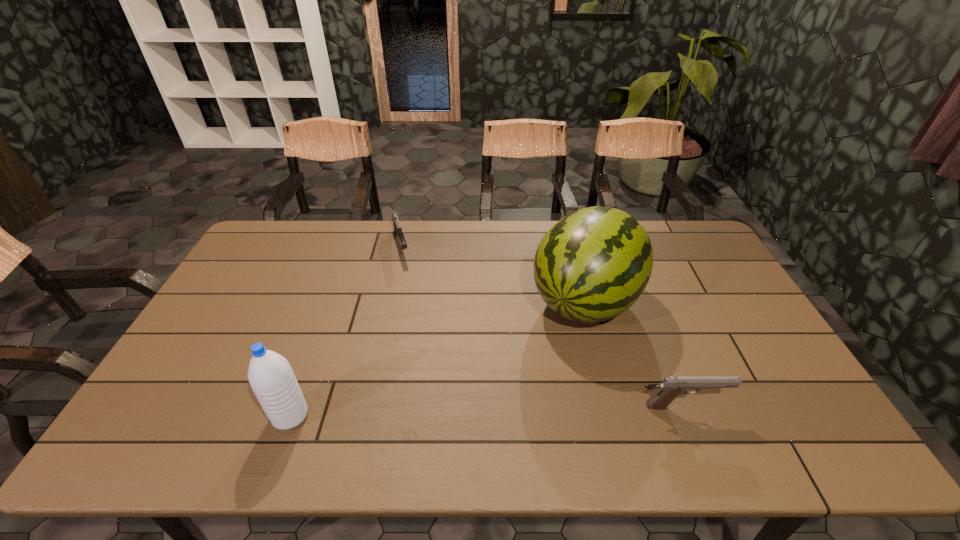
Locate an element on the screen. vacant space on the desktop that is between the water bottle and the third tallest object and is positioned at the muzzle end of the third object from right to left is located at coordinates (453, 412).

In order to click on vacant space on the desktop that is between the water bottle and the pistol and is positioned at the stem end of the watermelon in this screenshot , I will do click(x=498, y=411).